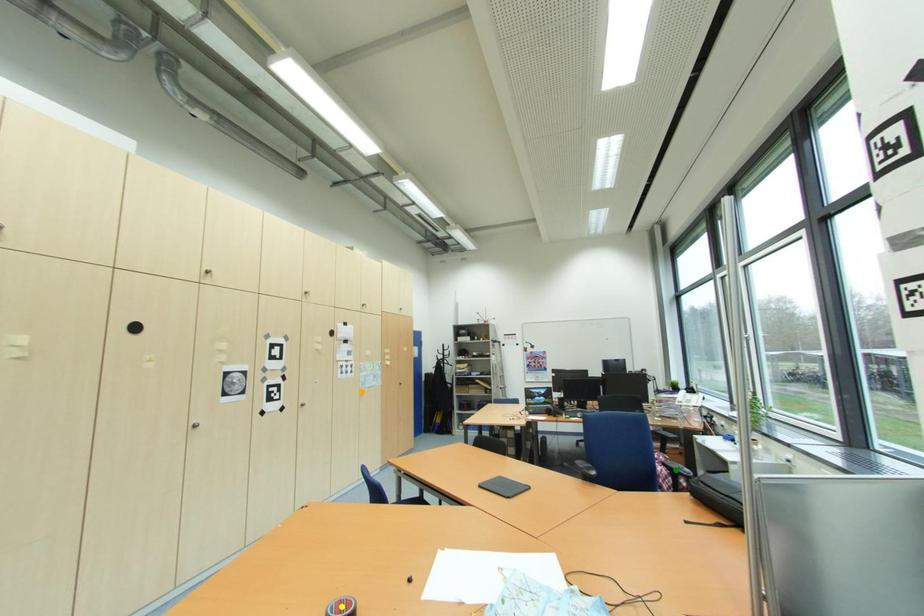
Order these from nearest to farthest:
1. green point
2. yellow point
3. orange point

yellow point → green point → orange point